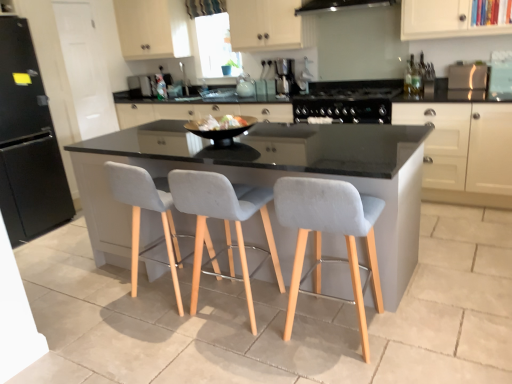
Identify the location of free point above satin silver toaster at upper right, the 3th appliance positioned from the back (from a real-world perspective). (465, 62).